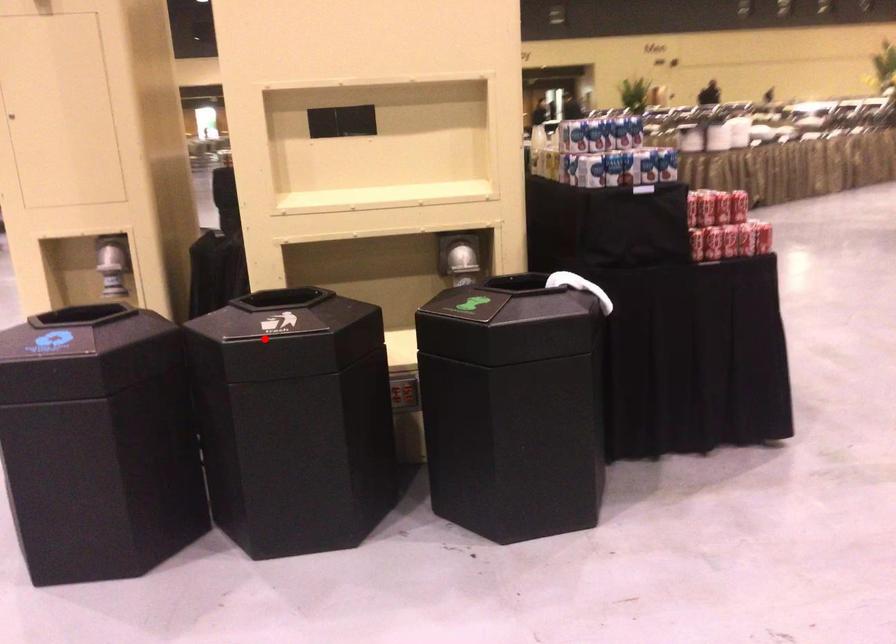
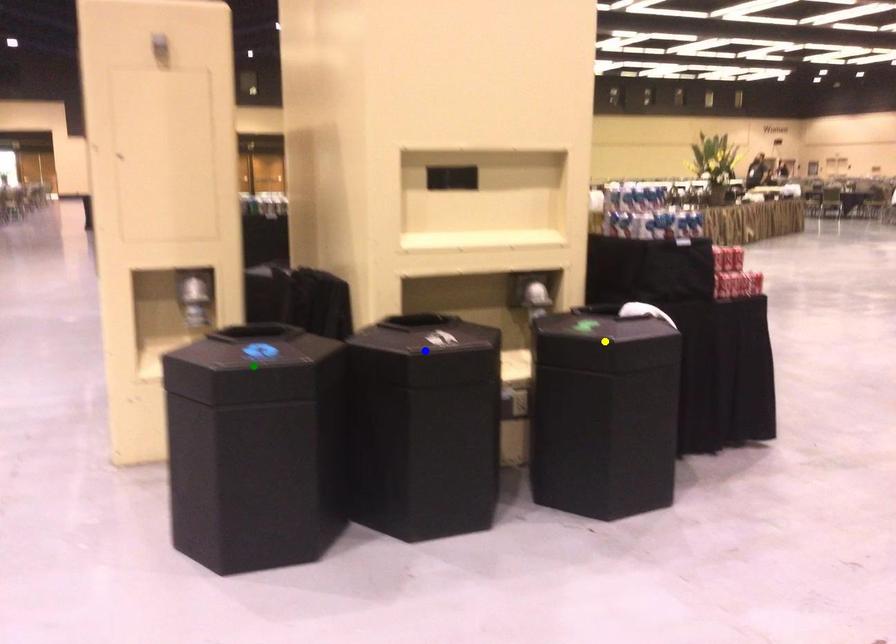
Question: I am providing you with two images of the same scene from different viewpoints. A red point is marked on the first image. You are given multiple points on the second image. Can you choose the point in image 2 that corresponds to the point in image 1?

Choices:
 (A) blue point
 (B) yellow point
 (C) green point

Answer: (A)